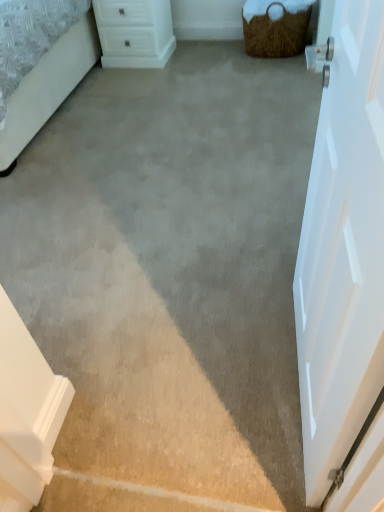
Find the location of a particular element. vacant region to the right of white plastic chest of drawers at upper center is located at coordinates (184, 53).